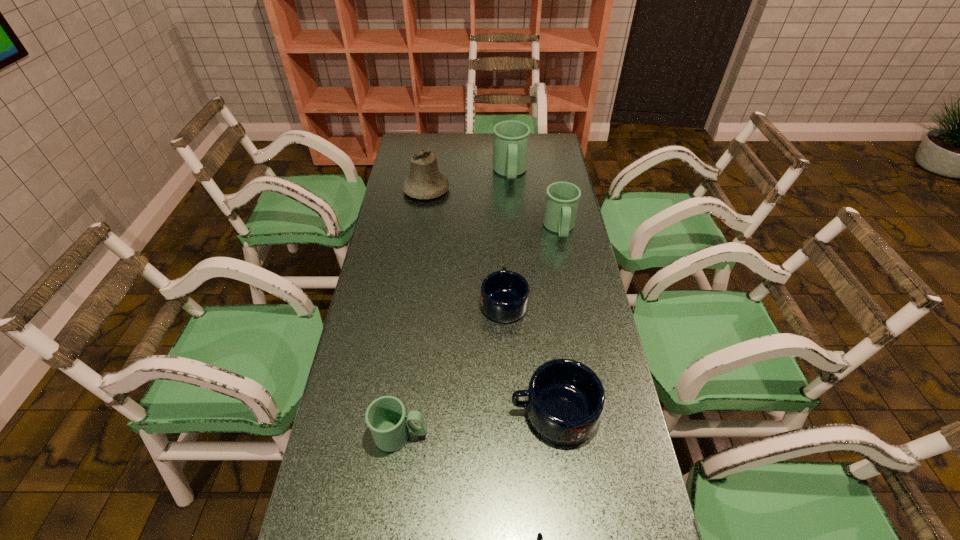
Where is `free location located 0.090m on the side of the biggest green mug with the handle`? The width and height of the screenshot is (960, 540). free location located 0.090m on the side of the biggest green mug with the handle is located at coordinates (513, 201).

The image size is (960, 540). I want to click on free space located on the front of the bell, so click(x=415, y=272).

The image size is (960, 540). What are the coordinates of `vacant area situated 0.110m on the side of the fifth shortest object with the handle` in the screenshot? It's located at (566, 267).

Locate an element on the screen. The width and height of the screenshot is (960, 540). vacant space located 0.240m with the handle on the side of the biggest blue mug is located at coordinates click(417, 411).

What are the coordinates of `vacant region located with the handle on the side of the biggest blue mug` in the screenshot? It's located at (405, 411).

Image resolution: width=960 pixels, height=540 pixels. What are the coordinates of `free space located with the handle on the side of the biggest blue mug` in the screenshot? It's located at (479, 411).

This screenshot has width=960, height=540. Find the location of `vacant space positioned on the side of the leftmost mug with the handle`. vacant space positioned on the side of the leftmost mug with the handle is located at coordinates (476, 435).

Identify the location of vacant space located 0.150m with the handle on the side of the fourth nearest object. (501, 251).

Locate an element on the screen. The height and width of the screenshot is (540, 960). free location located 0.400m with the handle on the side of the fourth nearest object is located at coordinates (499, 207).

You are a GUI agent. You are given a task and a screenshot of the screen. Output one action in this format:
    pyautogui.click(x=<x>, y=<y>)
    Task: Click on the free location located 0.240m with the handle on the side of the fourth nearest object
    
    Given the screenshot: What is the action you would take?
    pyautogui.click(x=501, y=234)